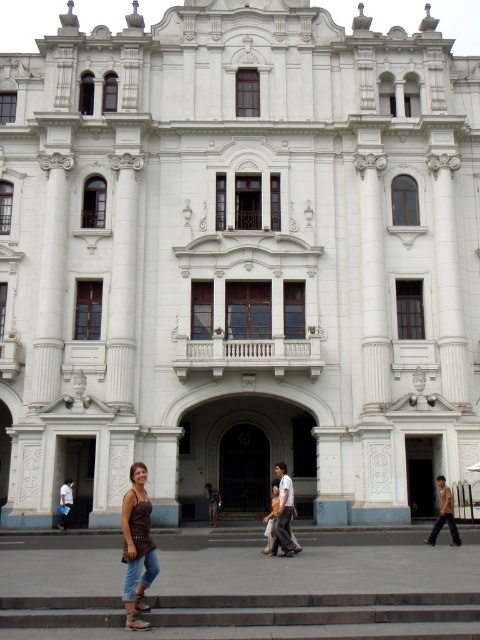
Looking at this image, you are standing in front of the grand ornate building and want to take a photo. You notice two points marked on your screen at coordinates point (326, 621) and point (434, 522). Which point is closer to you, the photographer?

Point (326, 621) is closer to the camera than point (434, 522), so the point closer to you is point (326, 621).

You are standing in front of the grand ornate building and see the light brown leather jacket at center. If you want to approach the jacket, which direction should you move relative to your current position?

Since the light brown leather jacket at center is located at point 0.805 on the x axis and 0.592 on the y axis, you should move towards the center of the image to reach it.